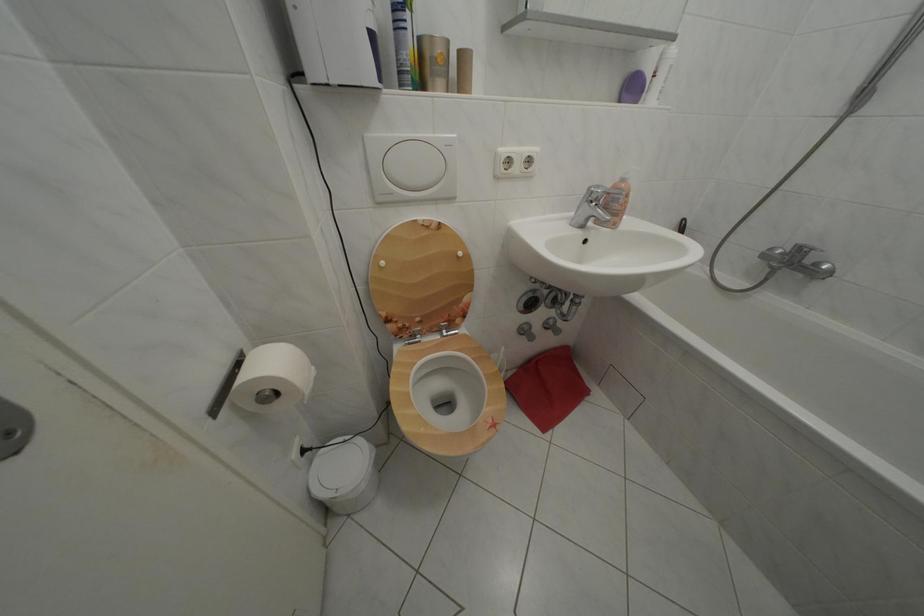
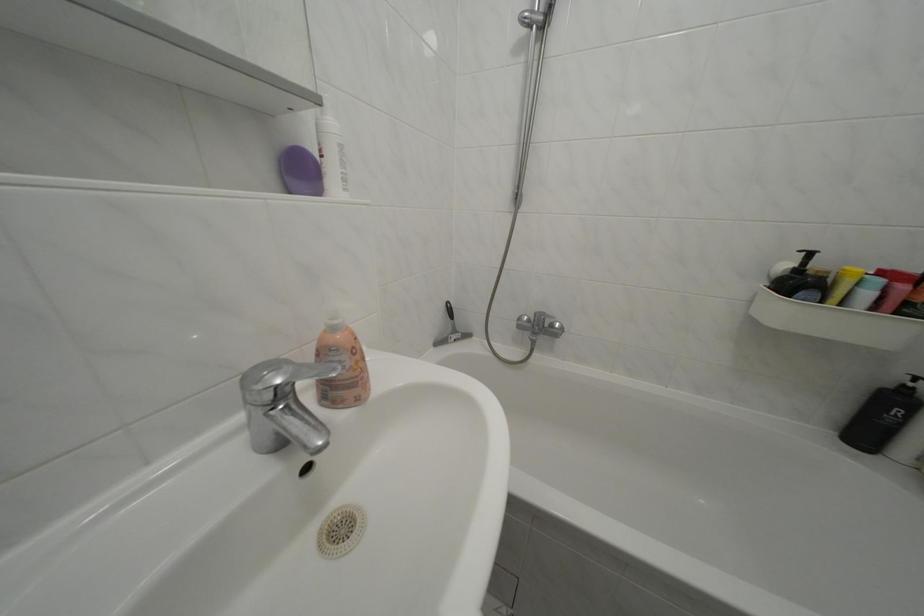
Question: Based on the continuous images, in which direction is the camera rotating? Reply with the corresponding letter.

Choices:
 (A) Left
 (B) Right
 (C) Up
 (D) Down

Answer: (B)